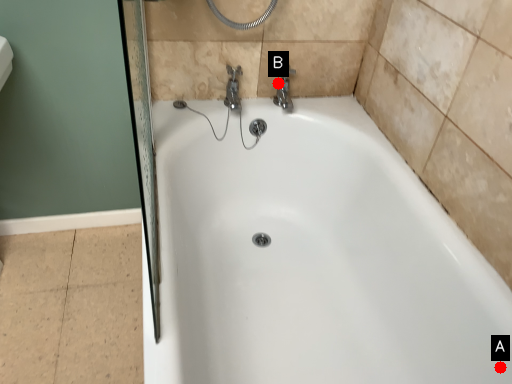
Question: Two points are circled on the image, labeled by A and B beside each circle. Which point appears farthest from the camera in this image?

Choices:
 (A) A is further
 (B) B is further

Answer: (B)